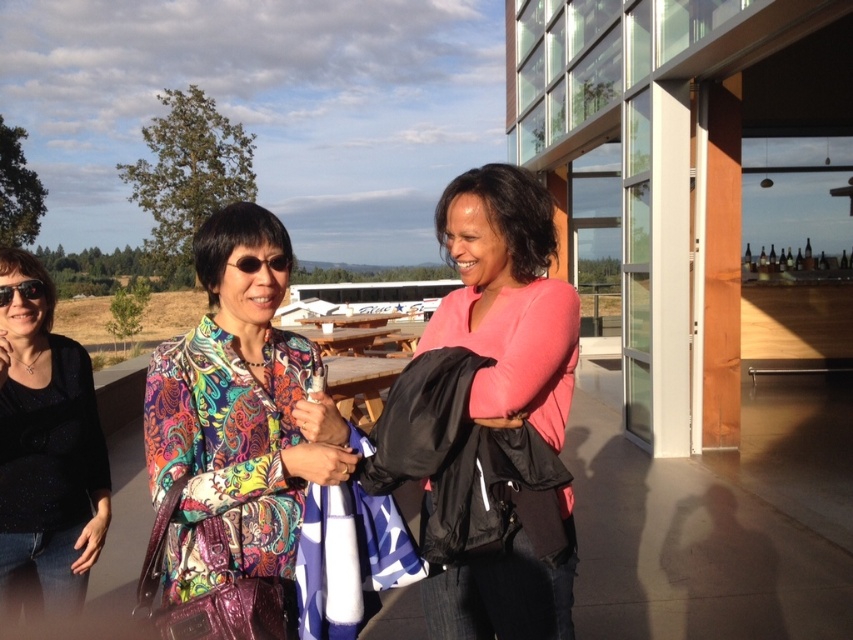
Can you confirm if pink matte jacket at center is positioned below black plastic goggles at upper left?

Indeed, pink matte jacket at center is positioned under black plastic goggles at upper left.

How distant is pink matte jacket at center from black plastic goggles at upper left?

pink matte jacket at center is 5.19 feet away from black plastic goggles at upper left.

The height and width of the screenshot is (640, 853). What do you see at coordinates (508, 300) in the screenshot?
I see `pink matte jacket at center` at bounding box center [508, 300].

Identify the location of pink matte jacket at center. The width and height of the screenshot is (853, 640). (508, 300).

Between pink matte jacket at center and matte black sunglasses at center, which one has less height?

Standing shorter between the two is matte black sunglasses at center.

Is pink matte jacket at center behind matte black sunglasses at center?

No, pink matte jacket at center is closer to the viewer.

Does point (495, 365) lie behind point (251, 260)?

That is False.

Where is `pink matte jacket at center`? pink matte jacket at center is located at coordinates (508, 300).

Between black plastic goggles at upper left and matte black sunglasses at center, which one appears on the left side from the viewer's perspective?

From the viewer's perspective, black plastic goggles at upper left appears more on the left side.

Which of these two, black plastic goggles at upper left or matte black sunglasses at center, stands taller?

black plastic goggles at upper left

Does point (12, 288) come in front of point (268, 259)?

No, it is behind (268, 259).

This screenshot has width=853, height=640. Identify the location of black plastic goggles at upper left. (21, 291).